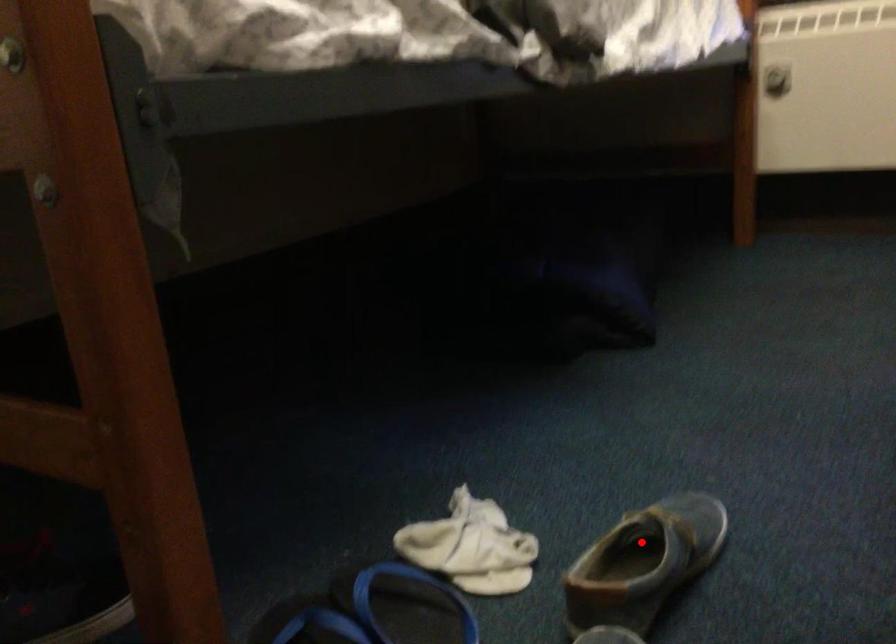
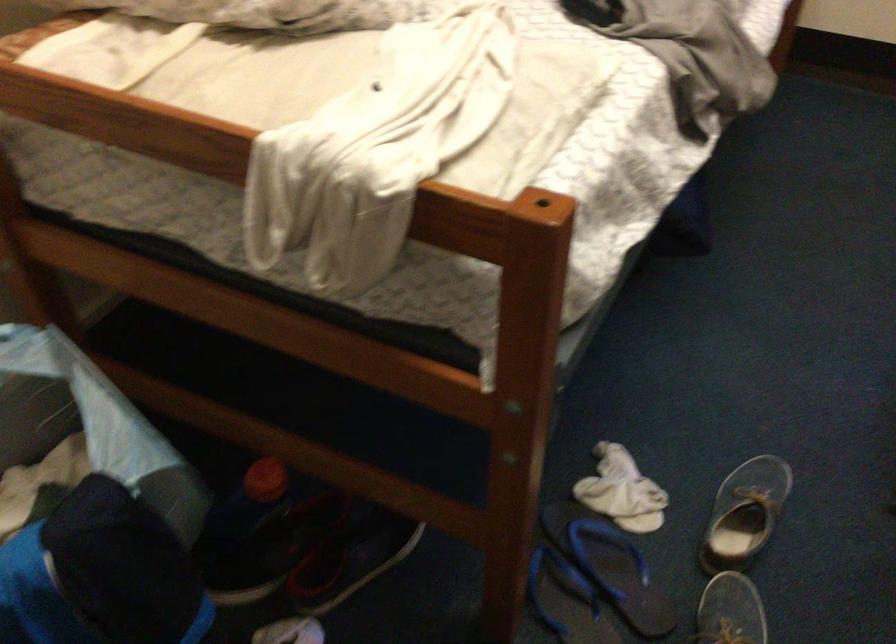
The point at the highlighted location is marked in the first image. Where is the corresponding point in the second image?

(745, 514)